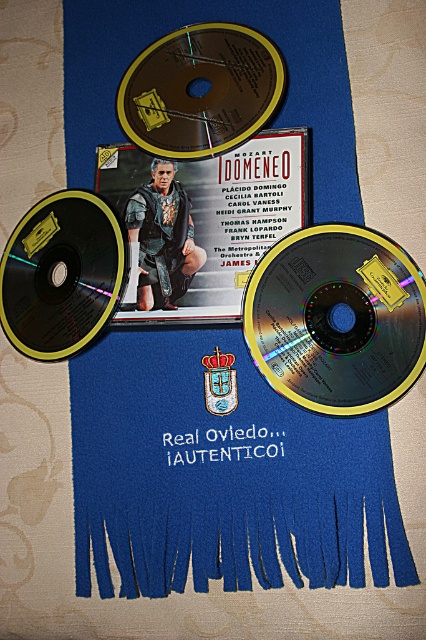
Between transparent plastic cd at center and black glossy cd at left, which one is positioned higher?

black glossy cd at left is higher up.

Is transparent plastic cd at center smaller than black glossy cd at left?

Incorrect, transparent plastic cd at center is not smaller in size than black glossy cd at left.

This screenshot has width=426, height=640. What do you see at coordinates (336, 317) in the screenshot?
I see `transparent plastic cd at center` at bounding box center [336, 317].

Image resolution: width=426 pixels, height=640 pixels. In order to click on transparent plastic cd at center in this screenshot , I will do `click(336, 317)`.

Can you confirm if gold compact disc at center is positioned above black glossy cd at left?

Indeed, gold compact disc at center is positioned over black glossy cd at left.

Who is lower down, gold compact disc at center or black glossy cd at left?

Positioned lower is black glossy cd at left.

Which is behind, point (213, 88) or point (11, 275)?

Point (11, 275)

This screenshot has width=426, height=640. I want to click on gold compact disc at center, so click(x=199, y=90).

Who is positioned more to the left, matte black album cover at center or black glossy cd at left?

From the viewer's perspective, black glossy cd at left appears more on the left side.

The height and width of the screenshot is (640, 426). Describe the element at coordinates (204, 220) in the screenshot. I see `matte black album cover at center` at that location.

Describe the element at coordinates (204, 220) in the screenshot. I see `matte black album cover at center` at that location.

The width and height of the screenshot is (426, 640). Find the location of `matte black album cover at center`. matte black album cover at center is located at coordinates (204, 220).